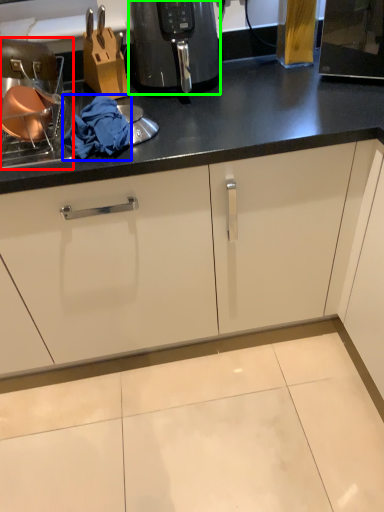
Question: Considering the real-world distances, which object is closest to appliance (highlighted by a red box)? material (highlighted by a blue box) or home appliance (highlighted by a green box).

Choices:
 (A) material
 (B) home appliance

Answer: (A)